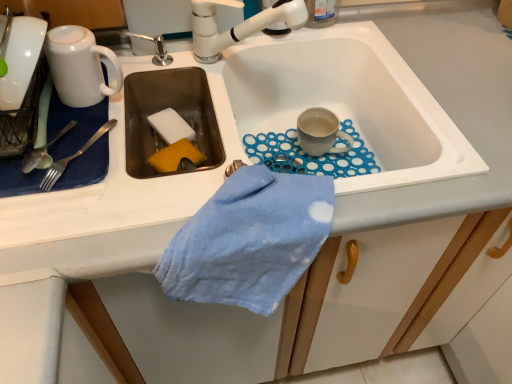
Question: Considering the relative positions of satin silver fork at left, which is the third silverware from left to right, and white ceramic tap at upper center in the image provided, is satin silver fork at left, which is the third silverware from left to right, to the left or to the right of white ceramic tap at upper center?

Choices:
 (A) right
 (B) left

Answer: (B)

Question: From the image's perspective, is satin silver fork at left, which is the third silverware from left to right, located above or below white ceramic tap at upper center?

Choices:
 (A) below
 (B) above

Answer: (A)

Question: Which object is the farthest from the white ceramic sink at center?

Choices:
 (A) white ceramic tap at upper center
 (B) matte gray mug at sink right, the 2th coffee cup positioned from the front
 (C) shiny silver fork at left, the 1th silverware positioned from the left
 (D) satin silver spoon at left, the second silverware positioned from the left
 (E) white sponge at sink left

Answer: (D)

Question: Estimate the real-world distances between objects in this image. Which object is closer to the satin silver spoon at left, the second silverware positioned from the left?

Choices:
 (A) satin silver fork at left, which is the third silverware from left to right
 (B) white glossy mug at upper left, which is counted as the 2th coffee cup, starting from the right
 (C) shiny silver fork at left, which is counted as the 3th silverware, starting from the right
 (D) white ceramic tap at upper center
 (E) white sponge at sink left

Answer: (C)